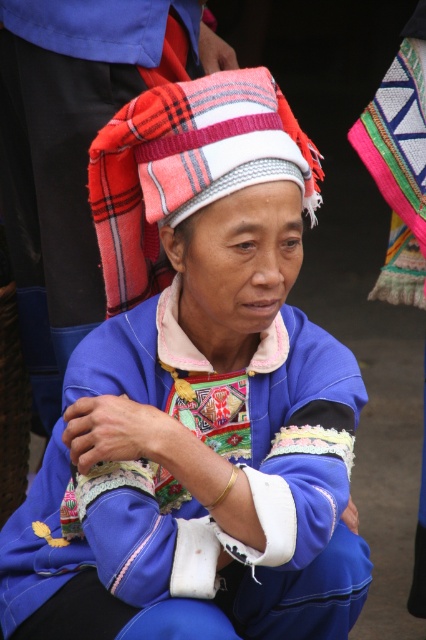
Question: Can you confirm if matte blue fabric at center is positioned to the left of knitted woolen hat at center?

Choices:
 (A) yes
 (B) no

Answer: (A)

Question: Among these objects, which one is nearest to the camera?

Choices:
 (A) knitted woolen hat at center
 (B) matte blue fabric at center

Answer: (A)

Question: Which of the following is the farthest from the observer?

Choices:
 (A) matte blue fabric at center
 (B) knitted woolen hat at center

Answer: (A)

Question: From the image, what is the correct spatial relationship of matte blue fabric at center in relation to knitted woolen hat at center?

Choices:
 (A) above
 (B) below

Answer: (A)

Question: Is the position of matte blue fabric at center more distant than that of knitted woolen hat at center?

Choices:
 (A) no
 (B) yes

Answer: (B)